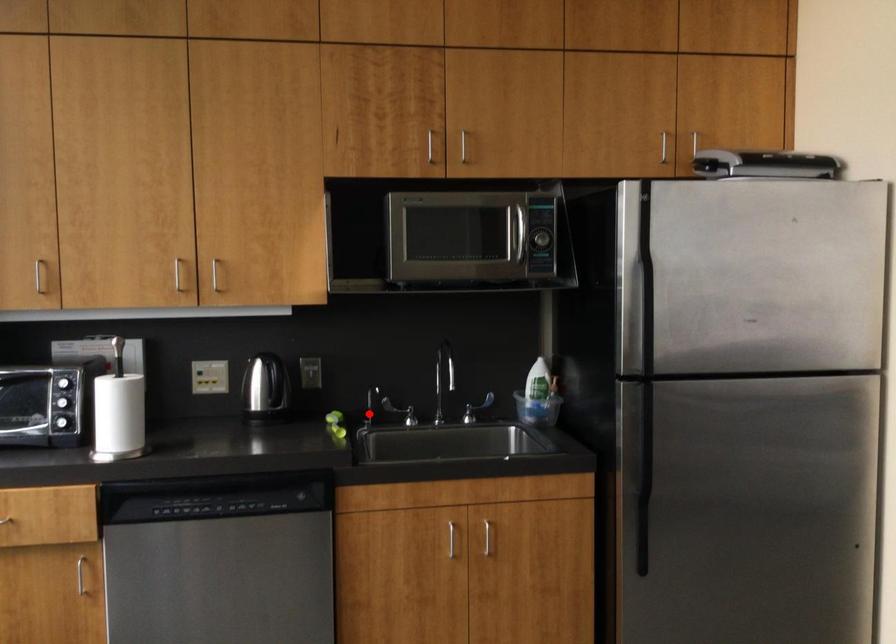
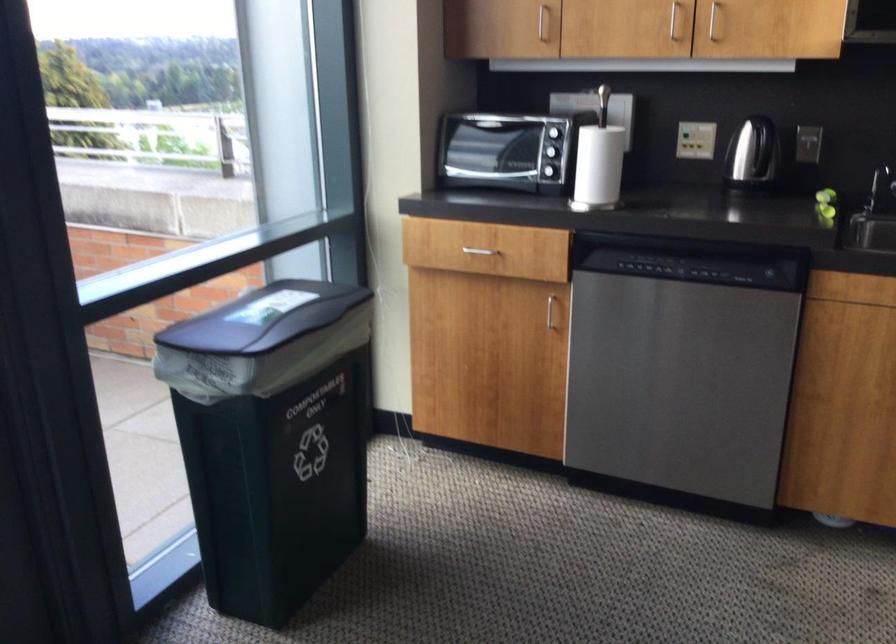
Question: I am providing you with two images of the same scene from different viewpoints. A red point is shown in image1. For the corresponding object point in image2, is it positioned nearer or farther from the camera?

Choices:
 (A) Nearer
 (B) Farther

Answer: (A)